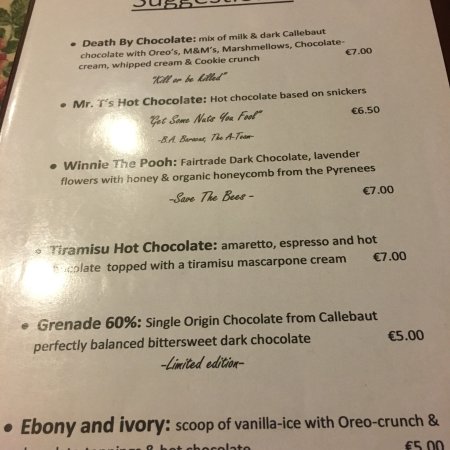
Find the location of a particular element. This screenshot has width=450, height=450. table cloth underneath the menu is located at coordinates (12, 18).